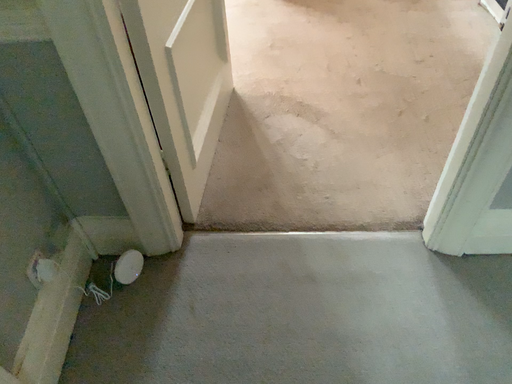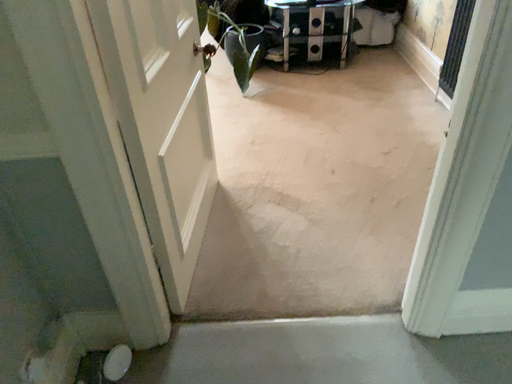
Question: Which way did the camera rotate in the video?

Choices:
 (A) rotated upward
 (B) rotated downward

Answer: (A)